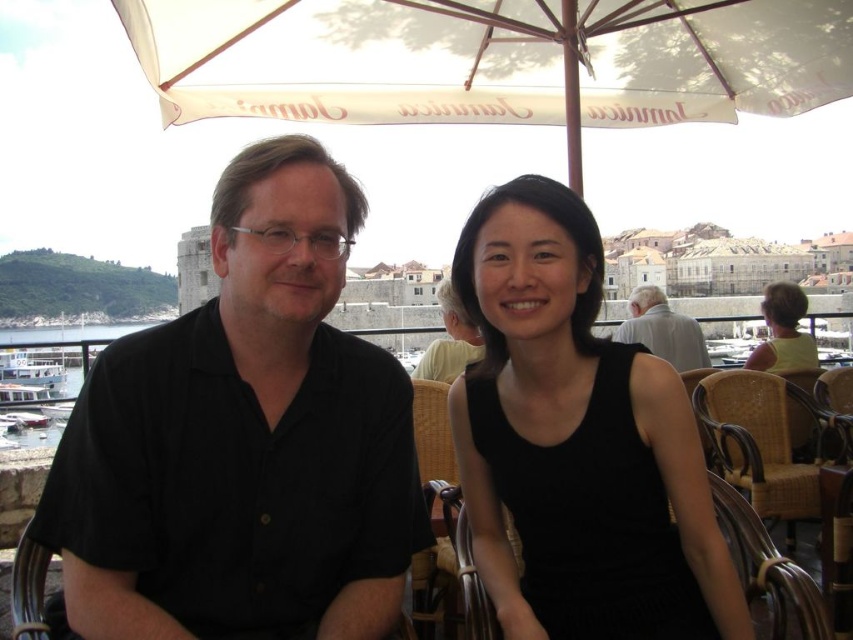
Which of these two, black shirt at left or white fabric umbrella at upper center, stands taller?

With more height is black shirt at left.

Is black shirt at left shorter than white fabric umbrella at upper center?

In fact, black shirt at left may be taller than white fabric umbrella at upper center.

Does point (264, 413) come farther from viewer compared to point (302, 67)?

No, it is not.

Locate an element on the screen. Image resolution: width=853 pixels, height=640 pixels. black shirt at left is located at coordinates (244, 440).

The image size is (853, 640). I want to click on yellow fabric dress at right, so click(x=782, y=332).

Who is more forward, (782, 317) or (454, 364)?

Point (454, 364) is more forward.

What do you see at coordinates (782, 332) in the screenshot? I see `yellow fabric dress at right` at bounding box center [782, 332].

Locate an element on the screen. yellow fabric dress at right is located at coordinates (782, 332).

Does gray fabric shirt at center appear under yellow fabric dress at right?

Correct, gray fabric shirt at center is located below yellow fabric dress at right.

Is gray fabric shirt at center to the left of yellow fabric dress at right from the viewer's perspective?

Correct, you'll find gray fabric shirt at center to the left of yellow fabric dress at right.

Between point (636, 314) and point (802, 348), which one is positioned behind?

The point (636, 314) is behind.

Locate an element on the screen. gray fabric shirt at center is located at coordinates (662, 330).